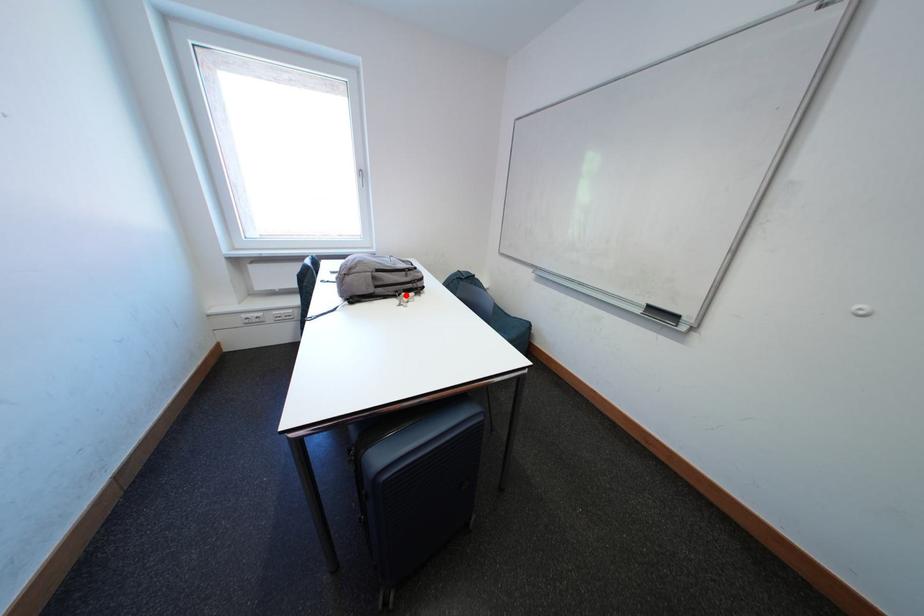
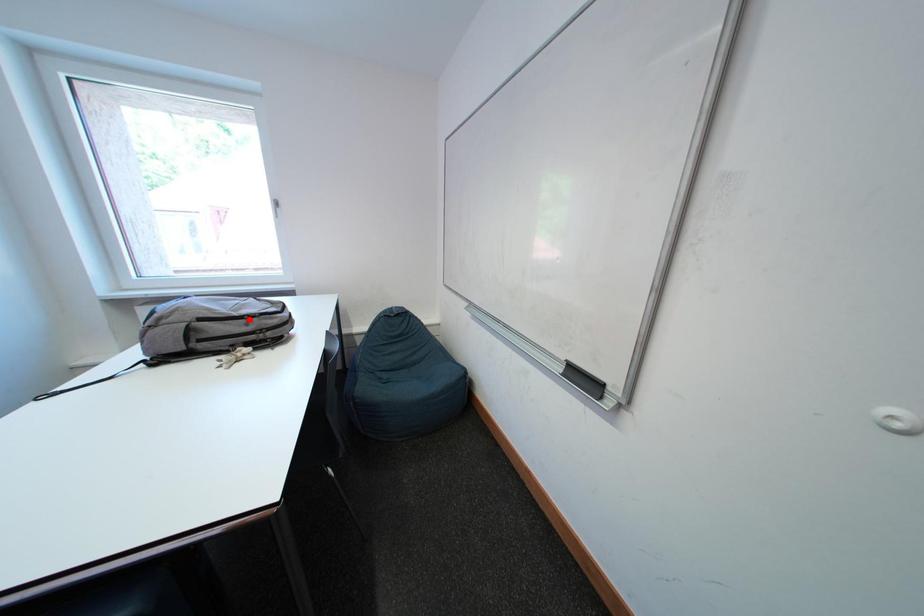
I am providing you with two images of the same scene from different viewpoints. A red point is marked on the first image and another point is marked on the second image. Do the highlighted points in image1 and image2 indicate the same real-world spot?

No